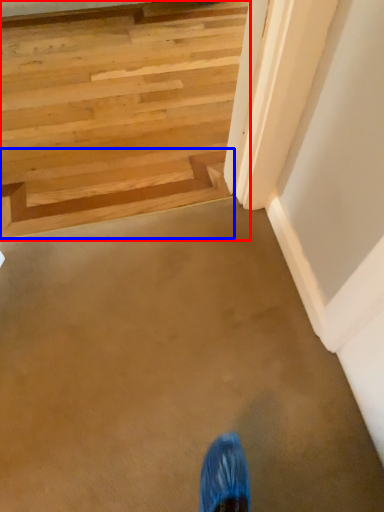
Question: Which object is further to the camera taking this photo, stairs (highlighted by a red box) or stairwell (highlighted by a blue box)?

Choices:
 (A) stairs
 (B) stairwell

Answer: (B)